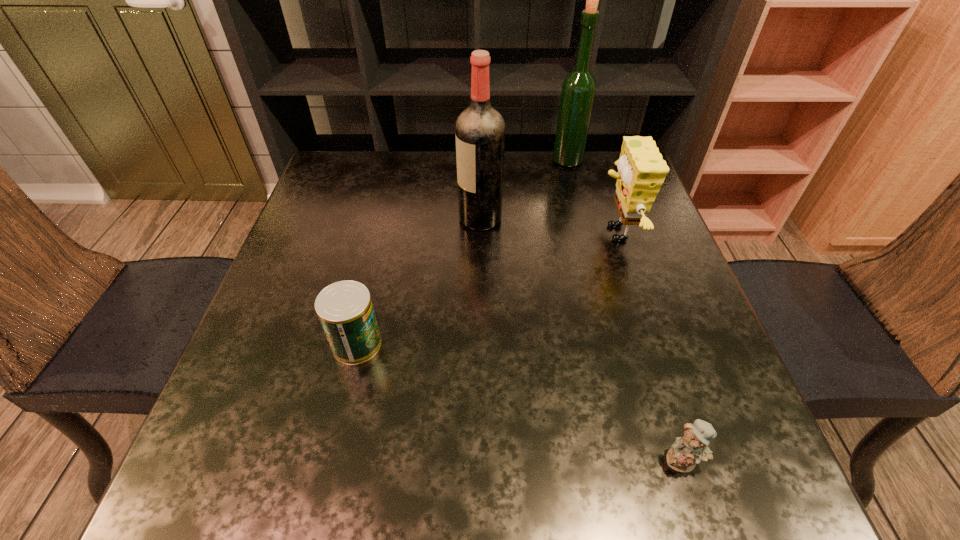
Where is `the right liquor`? The width and height of the screenshot is (960, 540). the right liquor is located at coordinates point(578,90).

Identify the location of the farthest object. This screenshot has height=540, width=960. (578, 90).

I want to click on the left liquor, so coord(480,129).

The image size is (960, 540). I want to click on the nearer liquor, so click(x=480, y=129).

At what (x,y) coordinates should I click in order to perform the action: click on sponge. Please return your answer as a coordinate pair (x, y). Image resolution: width=960 pixels, height=540 pixels. Looking at the image, I should click on (641, 169).

This screenshot has width=960, height=540. Find the location of `the fourth tallest object`. the fourth tallest object is located at coordinates (345, 310).

Where is `the fourth farthest object`? the fourth farthest object is located at coordinates (345, 310).

This screenshot has width=960, height=540. What are the coordinates of `the nearest object` in the screenshot? It's located at (692, 448).

You are a GUI agent. You are given a task and a screenshot of the screen. Output one action in this format:
    pyautogui.click(x=<x>, y=<y>)
    Task: Click on the shortest object
    This screenshot has width=960, height=540.
    Given the screenshot: What is the action you would take?
    pyautogui.click(x=692, y=448)

Where is `blank area located 0.270m on the left of the farther liquor`? blank area located 0.270m on the left of the farther liquor is located at coordinates (460, 160).